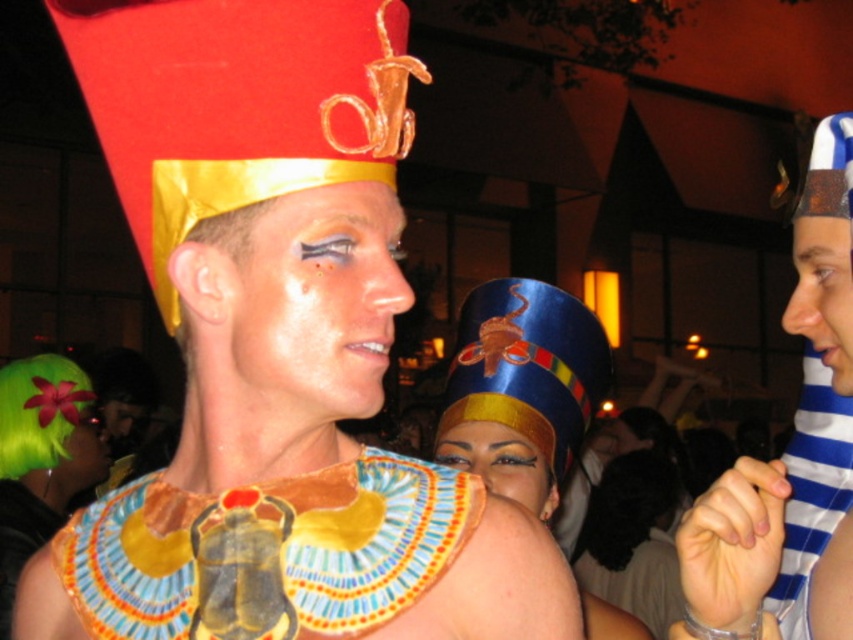
Question: Is shiny gold face paint at center above blue satin headdress at center?

Choices:
 (A) no
 (B) yes

Answer: (B)

Question: Among these points, which one is farthest from the camera?

Choices:
 (A) (828, 248)
 (B) (445, 384)
 (C) (750, 625)

Answer: (B)

Question: Which of the following is the closest to the observer?

Choices:
 (A) blue satin headdress at center
 (B) blue striped shirt at right
 (C) matte gold headdress at center
 (D) shiny gold face paint at center

Answer: (D)

Question: Among these objects, which one is nearest to the camera?

Choices:
 (A) blue striped shirt at right
 (B) blue striped fabric at right
 (C) matte gold headdress at center

Answer: (B)

Question: Can you confirm if painted leather collar at center is bigger than shiny gold face paint at center?

Choices:
 (A) yes
 (B) no

Answer: (A)

Question: Where is painted leather collar at center located in relation to matte gold headdress at center in the image?

Choices:
 (A) right
 (B) left

Answer: (B)